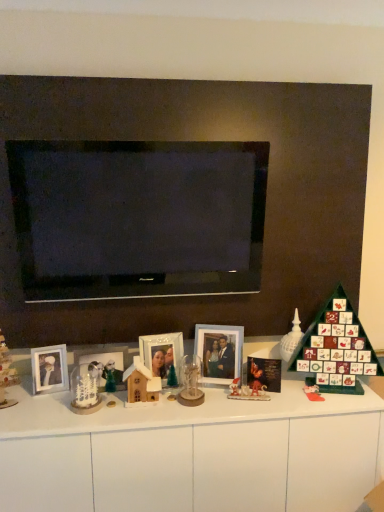
You are a GUI agent. You are given a task and a screenshot of the screen. Output one action in this format:
    pyautogui.click(x=<x>, y=<y>)
    Task: Click on the vacant area that lies to the right of wooden house at center, the first toy from the left
    
    Given the screenshot: What is the action you would take?
    pyautogui.click(x=177, y=409)